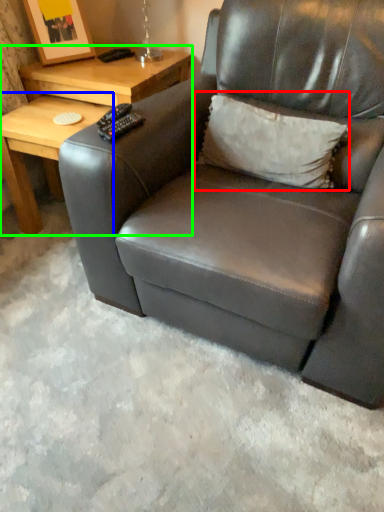
Question: Estimate the real-world distances between objects in this image. Which object is closer to throw pillow (highlighted by a red box), table (highlighted by a blue box) or table (highlighted by a green box)?

Choices:
 (A) table
 (B) table

Answer: (B)